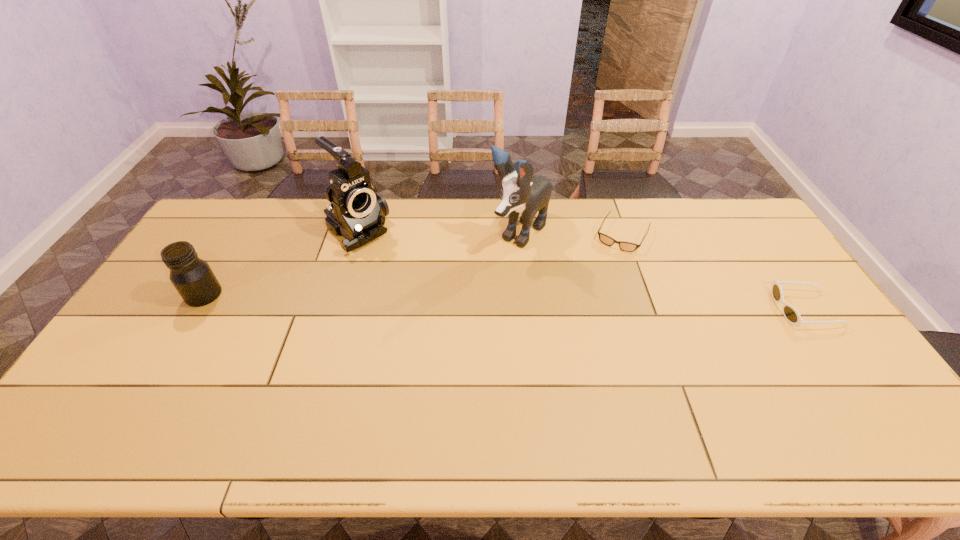
You are a GUI agent. You are given a task and a screenshot of the screen. Output one action in this format:
    pyautogui.click(x=<x>, y=<y>)
    Task: Click on the leftmost object
    
    Given the screenshot: What is the action you would take?
    pyautogui.click(x=192, y=277)

In order to click on jar in this screenshot , I will do `click(192, 277)`.

Where is `the nearer sunglasses`? Image resolution: width=960 pixels, height=540 pixels. the nearer sunglasses is located at coordinates (790, 313).

Find the location of `the right sunglasses`. the right sunglasses is located at coordinates (790, 313).

The height and width of the screenshot is (540, 960). In order to click on the tallest object in this screenshot , I will do `click(522, 192)`.

Find the location of a particular element. The width and height of the screenshot is (960, 540). puppy is located at coordinates (522, 192).

The width and height of the screenshot is (960, 540). Find the location of `the fourth object from right to left`. the fourth object from right to left is located at coordinates (357, 212).

The image size is (960, 540). What are the coordinates of `camcorder` in the screenshot? It's located at click(x=357, y=212).

What are the coordinates of `the shorter sunglasses` in the screenshot? It's located at (605, 239).

I want to click on the farther sunglasses, so click(605, 239).